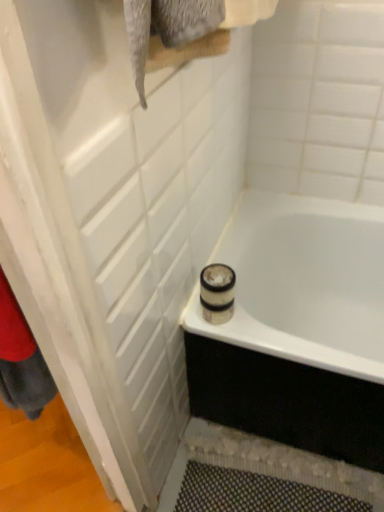
Question: Is there a large distance between white textured screen door at upper left and white glossy bathtub at lower right?

Choices:
 (A) yes
 (B) no

Answer: (B)

Question: Is the depth of white textured screen door at upper left greater than that of white glossy bathtub at lower right?

Choices:
 (A) yes
 (B) no

Answer: (B)

Question: Is white textured screen door at upper left thinner than white glossy bathtub at lower right?

Choices:
 (A) no
 (B) yes

Answer: (B)

Question: Considering the relative sizes of white textured screen door at upper left and white glossy bathtub at lower right in the image provided, is white textured screen door at upper left wider than white glossy bathtub at lower right?

Choices:
 (A) yes
 (B) no

Answer: (B)

Question: Is white textured screen door at upper left oriented towards white glossy bathtub at lower right?

Choices:
 (A) no
 (B) yes

Answer: (B)

Question: Is white textured screen door at upper left oriented away from white glossy bathtub at lower right?

Choices:
 (A) no
 (B) yes

Answer: (B)

Question: Does white glossy bathtub at lower right come behind white textured screen door at upper left?

Choices:
 (A) yes
 (B) no

Answer: (A)

Question: Considering the relative sizes of white glossy bathtub at lower right and white textured screen door at upper left in the image provided, is white glossy bathtub at lower right bigger than white textured screen door at upper left?

Choices:
 (A) yes
 (B) no

Answer: (A)

Question: Is white glossy bathtub at lower right not within white textured screen door at upper left?

Choices:
 (A) yes
 (B) no

Answer: (A)

Question: Is white textured screen door at upper left inside white glossy bathtub at lower right?

Choices:
 (A) yes
 (B) no

Answer: (B)

Question: Can you confirm if white glossy bathtub at lower right is taller than white textured screen door at upper left?

Choices:
 (A) no
 (B) yes

Answer: (A)

Question: Is white glossy bathtub at lower right smaller than white textured screen door at upper left?

Choices:
 (A) no
 (B) yes

Answer: (A)

Question: From the image's perspective, is white textured screen door at upper left positioned above or below white glossy bathtub at lower right?

Choices:
 (A) below
 (B) above

Answer: (B)